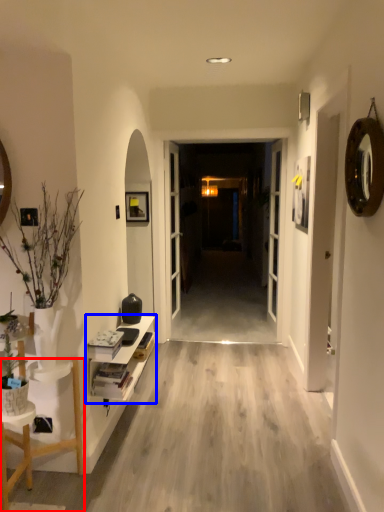
Question: Which object is further to the camera taking this photo, furniture (highlighted by a red box) or shelf (highlighted by a blue box)?

Choices:
 (A) furniture
 (B) shelf

Answer: (B)